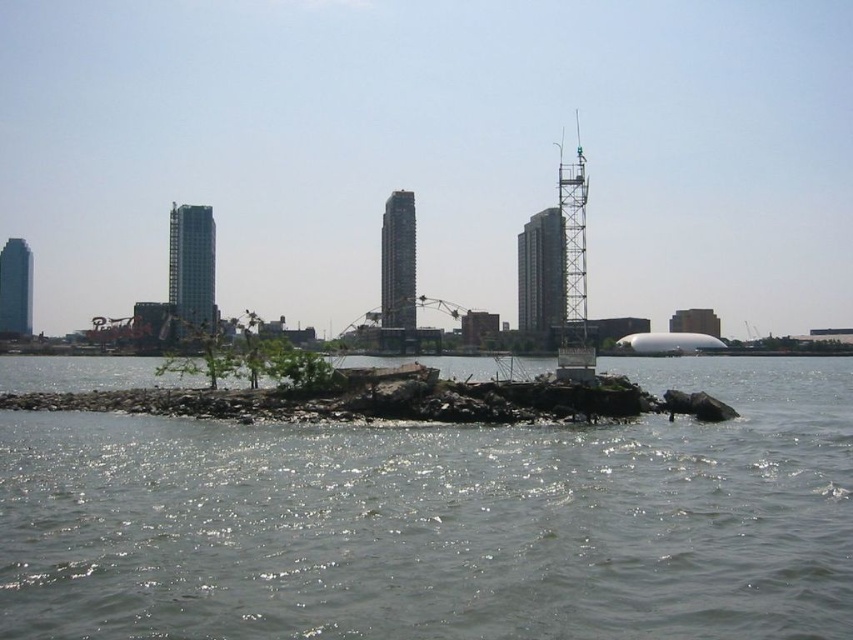
You are a construction inspector standing at the camera position. You need to inspect the metallic scaffolding at right. Given that your drone can fly up to 100 meters, will it be able to reach the scaffolding from your current position?

The metallic scaffolding at right is 101.35 meters away from the camera. Since the drone can only fly up to 100 meters, it cannot reach the scaffolding from the current position.